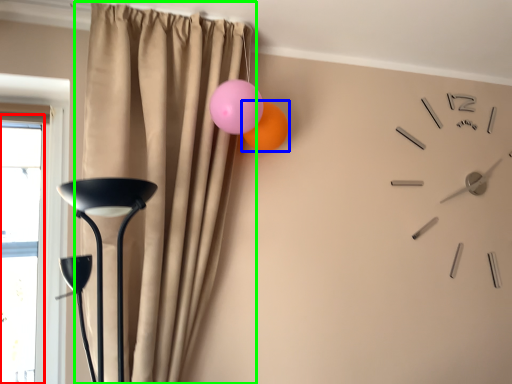
Question: Which object is positioned closest to window (highlighted by a red box)? Select from balloon (highlighted by a blue box) and curtain (highlighted by a green box).

Choices:
 (A) balloon
 (B) curtain

Answer: (B)